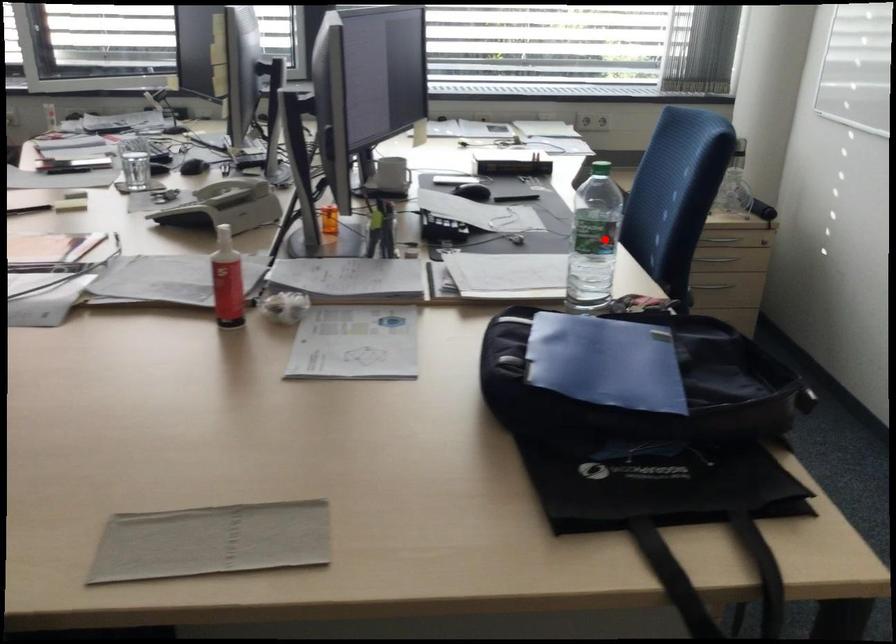
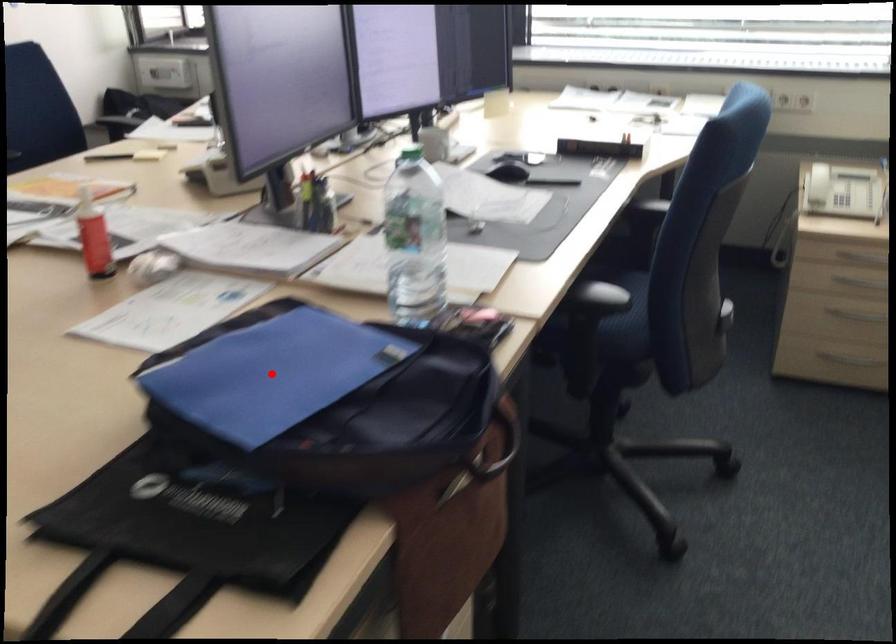
I am providing you with two images of the same scene from different viewpoints. A red point is marked on the first image and another point is marked on the second image. Are the points marked in image1 and image2 representing the same 3D position?

No